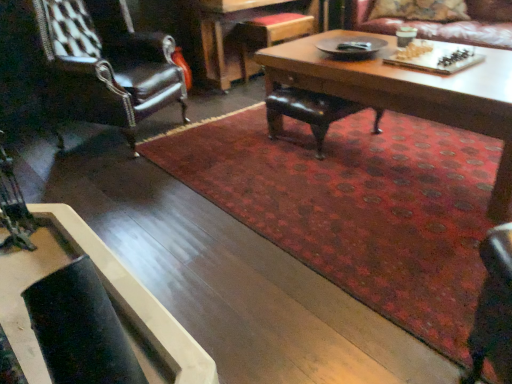
Measure the distance between point [405,39] and camera.

Point [405,39] is 2.32 meters from camera.

The width and height of the screenshot is (512, 384). What do you see at coordinates (110, 297) in the screenshot? I see `matte black coffee table at center, the 1th coffee table in the bottom-to-top sequence` at bounding box center [110, 297].

What is the approximate height of wooden coffee table at center, the 2th coffee table from the front?

It is 19.96 inches.

What do you see at coordinates (106, 64) in the screenshot? The image size is (512, 384). I see `leather armchair at left, acting as the second chair starting from the right` at bounding box center [106, 64].

Measure the distance between point (447, 0) and camera.

3.27 meters.

The width and height of the screenshot is (512, 384). What do you see at coordinates (420, 10) in the screenshot? I see `velvet floral pillow at upper right` at bounding box center [420, 10].

The width and height of the screenshot is (512, 384). What are the coordinates of `leather couch at upper right` in the screenshot? It's located at click(447, 24).

This screenshot has width=512, height=384. I want to click on matte brown cup at upper right, so click(x=405, y=36).

Is leather couch at upper right looking in the opposite direction of matte brown cup at upper right?

No, matte brown cup at upper right is not at the back of leather couch at upper right.

Would you say leather couch at upper right is to the left or to the right of matte brown cup at upper right in the picture?

In the image, leather couch at upper right appears on the right side of matte brown cup at upper right.

Is leather couch at upper right spatially inside matte brown cup at upper right, or outside of it?

leather couch at upper right is outside matte brown cup at upper right.

From the image's perspective, which is above, leather couch at upper right or matte brown cup at upper right?

leather couch at upper right.

From a real-world perspective, does leather couch at upper right sit lower than velvet floral pillow at upper right?

Correct, in the physical world, leather couch at upper right is lower than velvet floral pillow at upper right.

Can you confirm if leather couch at upper right is thinner than velvet floral pillow at upper right?

Incorrect, the width of leather couch at upper right is not less than that of velvet floral pillow at upper right.

Which point is more distant from viewer, (501, 9) or (382, 11)?

The point (382, 11) is farther from the camera.

From the image's perspective, which one is positioned lower, leather couch at upper right or velvet floral pillow at upper right?

leather couch at upper right, from the image's perspective.

At what (x,y) coordinates should I click in order to perform the action: click on the 2nd chair counting from the left of the velvet floral pillow at upper right. Please return your answer as a coordinate pair (x, y). This screenshot has height=384, width=512. Looking at the image, I should click on (106, 64).

From the picture: Is leather armchair at left, acting as the second chair starting from the right, wider than velvet floral pillow at upper right?

Yes, leather armchair at left, acting as the second chair starting from the right, is wider than velvet floral pillow at upper right.

Is point (182, 103) closer or farther from the camera than point (374, 15)?

Point (182, 103).

Based on the photo, is matte black coffee table at center, the 1th coffee table in the bottom-to-top sequence, wider or thinner than wooden table at center?

Clearly, matte black coffee table at center, the 1th coffee table in the bottom-to-top sequence, has less width compared to wooden table at center.

Is matte black coffee table at center, which is counted as the 1th coffee table, starting from the left, next to wooden table at center and touching it?

No, matte black coffee table at center, which is counted as the 1th coffee table, starting from the left, is not making contact with wooden table at center.

From a real-world perspective, is matte black coffee table at center, which appears as the 1th coffee table when viewed from the front, physically located above or below wooden table at center?

In terms of real-world spatial position, matte black coffee table at center, which appears as the 1th coffee table when viewed from the front, is below wooden table at center.

Does matte brown cup at upper right contain leather couch at upper right?

Definitely not — leather couch at upper right is not inside matte brown cup at upper right.

Does matte brown cup at upper right lie in front of leather couch at upper right?

Yes, matte brown cup at upper right is in front of leather couch at upper right.

Between matte brown cup at upper right and leather couch at upper right, which one has larger size?

leather couch at upper right is bigger.

The image size is (512, 384). I want to click on coffee cup below the leather couch at upper right (from the image's perspective), so click(405, 36).

From the image's perspective, relative to leather couch at upper right, is matte black coffee table at center, which is the second coffee table in back-to-front order, above or below?

From the image's perspective, matte black coffee table at center, which is the second coffee table in back-to-front order, appears below leather couch at upper right.

Is point (146, 362) behind point (453, 31)?

No, it is in front of (453, 31).

Considering the sizes of objects matte black coffee table at center, which is the second coffee table in back-to-front order, and leather couch at upper right in the image provided, who is smaller, matte black coffee table at center, which is the second coffee table in back-to-front order, or leather couch at upper right?

With smaller size is matte black coffee table at center, which is the second coffee table in back-to-front order.

Is matte black coffee table at center, the 2th coffee table when ordered from right to left, not inside leather couch at upper right?

That's correct, matte black coffee table at center, the 2th coffee table when ordered from right to left, is outside of leather couch at upper right.

Could you measure the distance between leather armchair at left, acting as the second chair starting from the right, and matte black coffee table at center, the 1th coffee table in the bottom-to-top sequence?

They are 3.83 feet apart.

From the image's perspective, does leather armchair at left, acting as the second chair starting from the right, appear higher than matte black coffee table at center, which is counted as the 1th coffee table, starting from the left?

Yes, from the image's perspective, leather armchair at left, acting as the second chair starting from the right, is above matte black coffee table at center, which is counted as the 1th coffee table, starting from the left.

Based on the photo, considering the relative sizes of leather armchair at left, which ranks as the 1th chair in left-to-right order, and matte black coffee table at center, which appears as the 1th coffee table when viewed from the front, in the image provided, is leather armchair at left, which ranks as the 1th chair in left-to-right order, taller than matte black coffee table at center, which appears as the 1th coffee table when viewed from the front,?

Correct, leather armchair at left, which ranks as the 1th chair in left-to-right order, is much taller as matte black coffee table at center, which appears as the 1th coffee table when viewed from the front.

From a real-world perspective, which object stands above the other?

leather armchair at left, which ranks as the 1th chair in left-to-right order, is physically above.

Where is `coffee cup located in front of the leather couch at upper right`? The image size is (512, 384). coffee cup located in front of the leather couch at upper right is located at coordinates tap(405, 36).

The height and width of the screenshot is (384, 512). In order to click on pillow above the leather couch at upper right (from the image's perspective) in this screenshot , I will do `click(420, 10)`.

From the image, which object appears to be farther from wooden table at center, leather couch at upper right or wooden coffee table at center, marked as the 1th coffee table in a right-to-left arrangement?

wooden coffee table at center, marked as the 1th coffee table in a right-to-left arrangement, is further to wooden table at center.

Looking at the image, which one is located further to leather at center, which is the second chair in left-to-right order, leather couch at upper right or velvet floral pillow at upper right?

velvet floral pillow at upper right is further to leather at center, which is the second chair in left-to-right order.

From the image, which object appears to be nearer to matte black coffee table at center, the 2th coffee table when ordered from right to left, matte brown cup at upper right or leather at center, which is the first chair in right-to-left order?

leather at center, which is the first chair in right-to-left order, lies closer to matte black coffee table at center, the 2th coffee table when ordered from right to left, than the other object.

When comparing their distances from velvet floral pillow at upper right, does wooden table at center or wooden coffee table at center, which appears as the first coffee table when viewed from the back, seem further?

wooden coffee table at center, which appears as the first coffee table when viewed from the back, is positioned further to the anchor velvet floral pillow at upper right.

When comparing their distances from wooden table at center, does leather couch at upper right or matte brown cup at upper right seem closer?

leather couch at upper right lies closer to wooden table at center than the other object.

Estimate the real-world distances between objects in this image. Which object is closer to leather couch at upper right, matte brown cup at upper right or velvet floral pillow at upper right?

velvet floral pillow at upper right.

Which object lies further to the anchor point wooden table at center, wooden coffee table at center, placed as the 2th coffee table when sorted from bottom to top, or leather armchair at left, which ranks as the 1th chair in left-to-right order?

Among the two, wooden coffee table at center, placed as the 2th coffee table when sorted from bottom to top, is located further to wooden table at center.

Considering their positions, is wooden coffee table at center, which is the 2th coffee table from left to right, positioned closer to leather couch at upper right than leather at center, which is the second chair in left-to-right order?

wooden coffee table at center, which is the 2th coffee table from left to right, is positioned closer to the anchor leather couch at upper right.

Image resolution: width=512 pixels, height=384 pixels. Find the location of `chair located between wooden table at center and leather couch at upper right in the left-right direction`. chair located between wooden table at center and leather couch at upper right in the left-right direction is located at coordinates (307, 112).

The height and width of the screenshot is (384, 512). I want to click on coffee cup located between wooden coffee table at center, the 2th coffee table from the front, and leather couch at upper right in the depth direction, so click(405, 36).

Where is `coffee cup between leather at center, which is the first chair in right-to-left order, and velvet floral pillow at upper right in the front-back direction`? coffee cup between leather at center, which is the first chair in right-to-left order, and velvet floral pillow at upper right in the front-back direction is located at coordinates (405, 36).

You are a GUI agent. You are given a task and a screenshot of the screen. Output one action in this format:
    pyautogui.click(x=<x>, y=<y>)
    Task: Click on the coffee cup located between wooden table at center and velvet floral pillow at upper right in the left-right direction
    The image size is (512, 384).
    Given the screenshot: What is the action you would take?
    pyautogui.click(x=405, y=36)